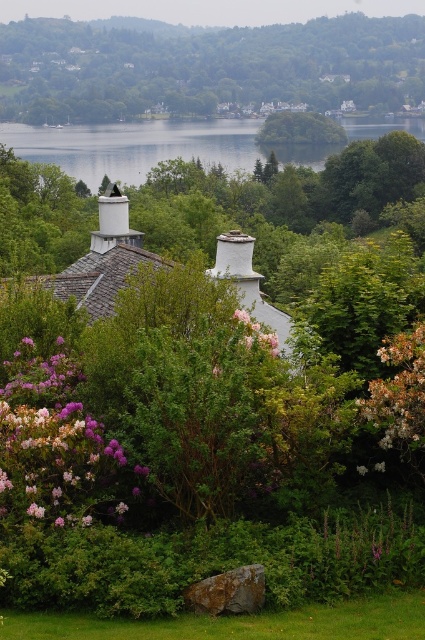
Does purple matte flower at lower left appear over green leafy tree at center?

No, purple matte flower at lower left is not above green leafy tree at center.

Between purple matte flower at lower left and green leafy tree at center, which one has more height?

green leafy tree at center

Does point (74, 458) come farther from viewer compared to point (300, 141)?

No, it is not.

What are the coordinates of `purple matte flower at lower left` in the screenshot? It's located at (56, 442).

Looking at this image, is green leafy tree at upper center above purple matte flower at center-right?

Yes, green leafy tree at upper center is above purple matte flower at center-right.

Can you confirm if green leafy tree at upper center is taller than purple matte flower at center-right?

Correct, green leafy tree at upper center is much taller as purple matte flower at center-right.

Describe the element at coordinates (204, 65) in the screenshot. I see `green leafy tree at upper center` at that location.

This screenshot has height=640, width=425. In order to click on green leafy tree at upper center in this screenshot , I will do `click(204, 65)`.

Does white matte chimney at upper center appear over pink matte flower at center?

Yes.

Between point (112, 212) and point (266, 337), which one is positioned in front?

Point (266, 337) is in front.

Who is more distant from viewer, (x=124, y=209) or (x=269, y=340)?

Point (x=124, y=209)

Locate an element on the screen. The width and height of the screenshot is (425, 640). white matte chimney at upper center is located at coordinates (113, 221).